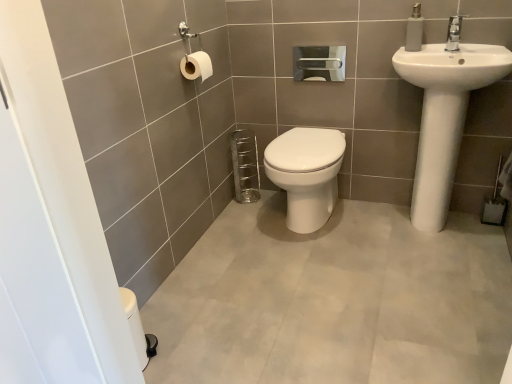
Locate an element on the screen. free region on the left part of white ceramic faucet at upper right is located at coordinates (422, 50).